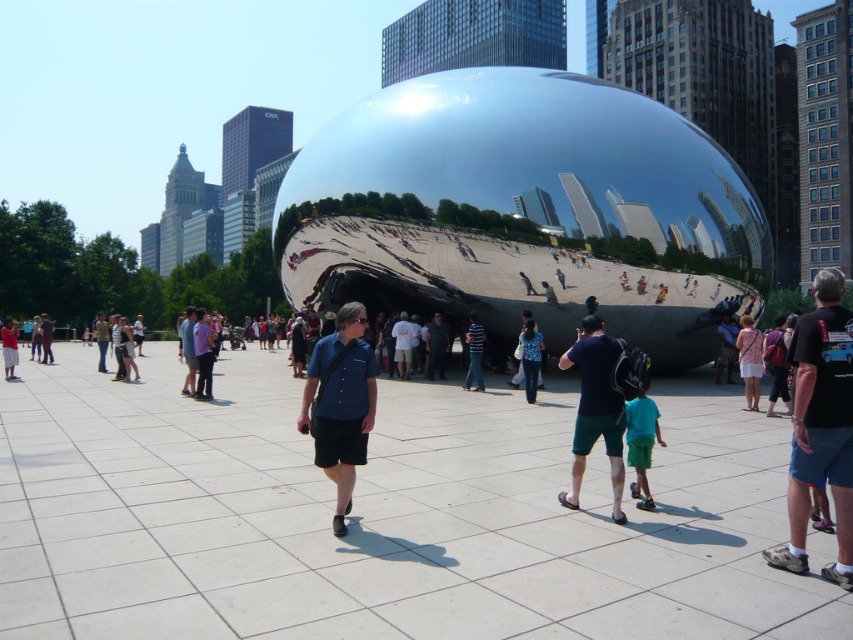
Is point (851, 328) closer to camera compared to point (531, 342)?

Yes, point (851, 328) is closer to viewer.

Is point (798, 496) more distant than point (526, 320)?

No, it is not.

Describe the element at coordinates (820, 426) in the screenshot. I see `black cotton shirt at right` at that location.

Where is `black cotton shirt at right`? The height and width of the screenshot is (640, 853). black cotton shirt at right is located at coordinates [820, 426].

Between black cotton shirt at right and green shorts at center, which one appears on the left side from the viewer's perspective?

green shorts at center

Can you confirm if black cotton shirt at right is shorter than green shorts at center?

Incorrect, black cotton shirt at right's height does not fall short of green shorts at center's.

Is point (821, 358) closer to camera compared to point (630, 436)?

Yes.

Where is `black cotton shirt at right`? This screenshot has height=640, width=853. black cotton shirt at right is located at coordinates (820, 426).

Between point (618, 518) and point (648, 412), which one is positioned in front?

Point (618, 518) is more forward.

The width and height of the screenshot is (853, 640). What do you see at coordinates (595, 408) in the screenshot?
I see `dark blue shirt at center` at bounding box center [595, 408].

In order to click on dark blue shirt at center in this screenshot , I will do `click(595, 408)`.